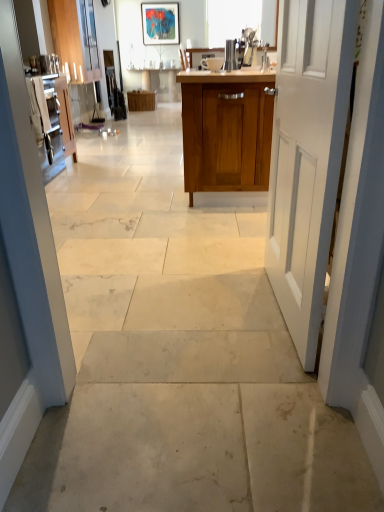
You are a GUI agent. You are given a task and a screenshot of the screen. Output one action in this format:
    pyautogui.click(x=<x>, y=<y>)
    Task: Click on the vacant space to the left of white matte door at right
    The height and width of the screenshot is (512, 384).
    Given the screenshot: What is the action you would take?
    pyautogui.click(x=188, y=307)